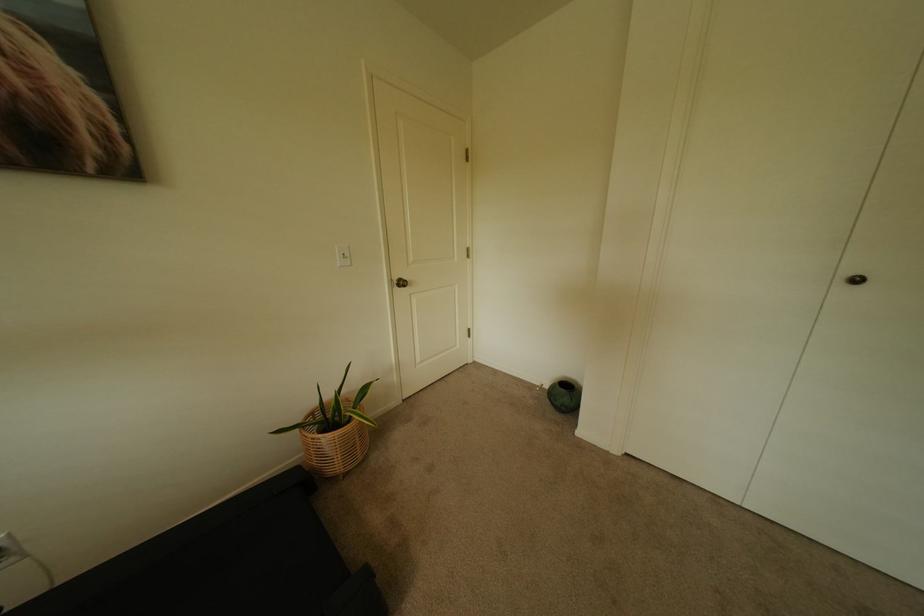
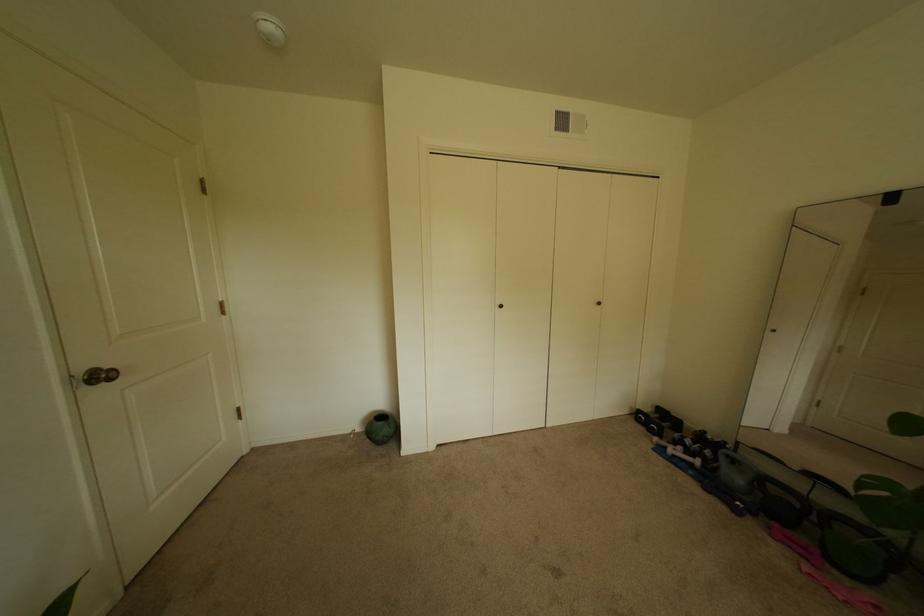
Question: Based on the continuous images, in which direction is the camera rotating? Reply with the corresponding letter.

Choices:
 (A) Left
 (B) Right
 (C) Up
 (D) Down

Answer: (B)